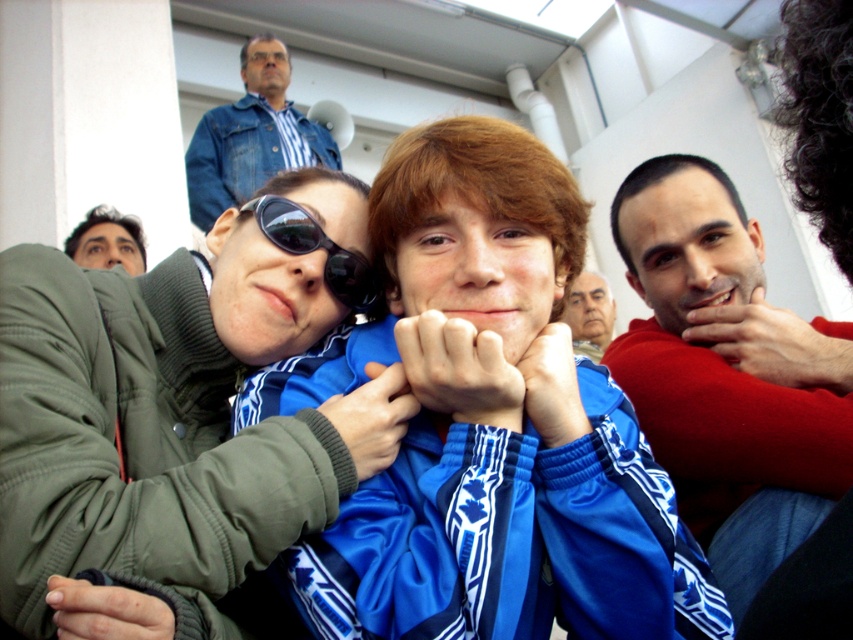
You are trying to decide whether to place a rectangular photo frame that is 10 inches wide on the smooth red sweater at right or the black reflective sunglasses at center. Based on their widths, which object can definitely fit the photo frame?

The smooth red sweater at right might be wider than black reflective sunglasses at center, so the smooth red sweater at right can definitely fit the photo frame since it is wider.